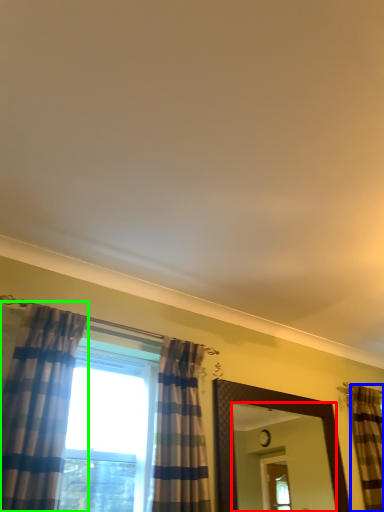
Question: Considering the real-world distances, which object is farthest from mirror (highlighted by a red box)? curtain (highlighted by a blue box) or curtain (highlighted by a green box)?

Choices:
 (A) curtain
 (B) curtain

Answer: (B)